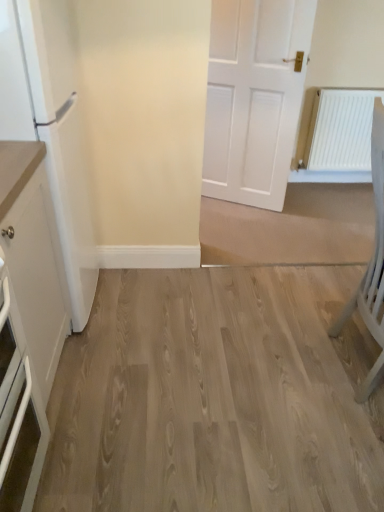
At what (x,y) coordinates should I click in order to perform the action: click on vacant space behind light gray wooden chair at right. Please return your answer as a coordinate pair (x, y). This screenshot has width=384, height=512. Looking at the image, I should click on (305, 303).